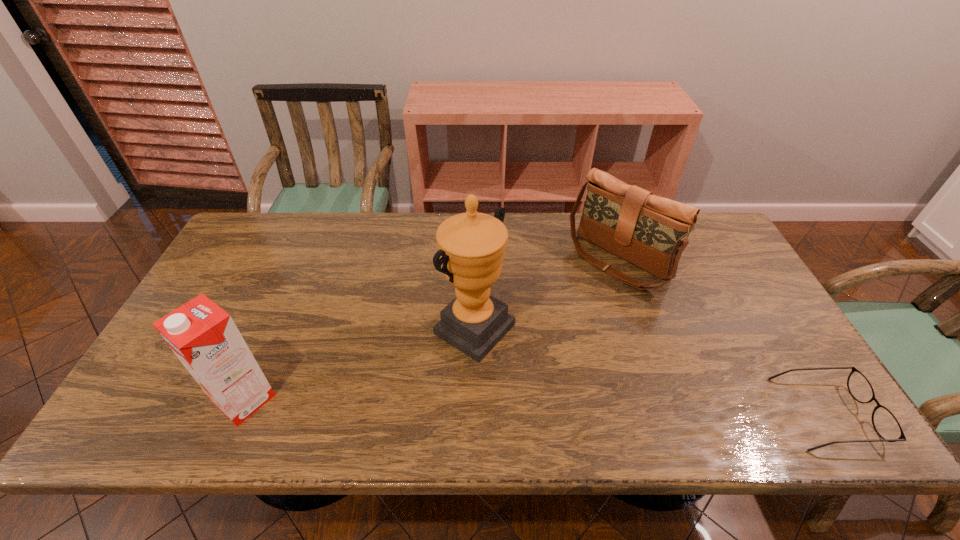
At what (x,y) coordinates should I click in order to perform the action: click on free space that satisfies the following two spatial constraints: 1. on the back side of the second tallest object; 2. on the right side of the farthest object. Please return your answer as a coordinate pair (x, y). The height and width of the screenshot is (540, 960). Looking at the image, I should click on (x=304, y=260).

Where is `vacant region that satisfies the following two spatial constraints: 1. on the front side of the carton; 2. on the front-facing side of the shortest object`? vacant region that satisfies the following two spatial constraints: 1. on the front side of the carton; 2. on the front-facing side of the shortest object is located at coordinates (238, 413).